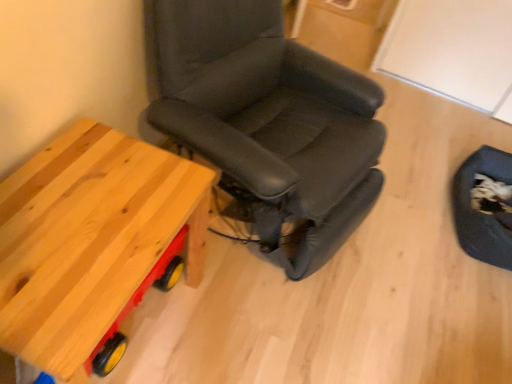
Question: Does dark blue fabric swivel chair at lower right have a greater width compared to black leather chair at center?

Choices:
 (A) no
 (B) yes

Answer: (A)

Question: Is dark blue fabric swivel chair at lower right surrounding black leather chair at center?

Choices:
 (A) no
 (B) yes

Answer: (A)

Question: From the image's perspective, is dark blue fabric swivel chair at lower right located above black leather chair at center?

Choices:
 (A) yes
 (B) no

Answer: (B)

Question: From a real-world perspective, does dark blue fabric swivel chair at lower right sit lower than black leather chair at center?

Choices:
 (A) no
 (B) yes

Answer: (B)

Question: Considering the relative sizes of dark blue fabric swivel chair at lower right and black leather chair at center in the image provided, is dark blue fabric swivel chair at lower right taller than black leather chair at center?

Choices:
 (A) yes
 (B) no

Answer: (B)

Question: Looking at their shapes, would you say black leather chair at center is wider or thinner than natural wood table at left?

Choices:
 (A) thin
 (B) wide

Answer: (B)

Question: From the image's perspective, is black leather chair at center above or below natural wood table at left?

Choices:
 (A) below
 (B) above

Answer: (B)

Question: In the image, is black leather chair at center on the left side or the right side of natural wood table at left?

Choices:
 (A) left
 (B) right

Answer: (B)

Question: In terms of size, does black leather chair at center appear bigger or smaller than natural wood table at left?

Choices:
 (A) small
 (B) big

Answer: (B)

Question: From a real-world perspective, is natural wood table at left above or below dark blue fabric swivel chair at lower right?

Choices:
 (A) above
 (B) below

Answer: (A)

Question: Is natural wood table at left taller or shorter than dark blue fabric swivel chair at lower right?

Choices:
 (A) tall
 (B) short

Answer: (A)

Question: In terms of size, does natural wood table at left appear bigger or smaller than dark blue fabric swivel chair at lower right?

Choices:
 (A) big
 (B) small

Answer: (A)

Question: Considering their positions, is natural wood table at left located in front of or behind dark blue fabric swivel chair at lower right?

Choices:
 (A) front
 (B) behind

Answer: (A)

Question: Considering the positions of dark blue fabric swivel chair at lower right and natural wood table at left in the image, is dark blue fabric swivel chair at lower right taller or shorter than natural wood table at left?

Choices:
 (A) short
 (B) tall

Answer: (A)

Question: Considering the relative positions of dark blue fabric swivel chair at lower right and natural wood table at left in the image provided, is dark blue fabric swivel chair at lower right to the left or to the right of natural wood table at left?

Choices:
 (A) left
 (B) right

Answer: (B)